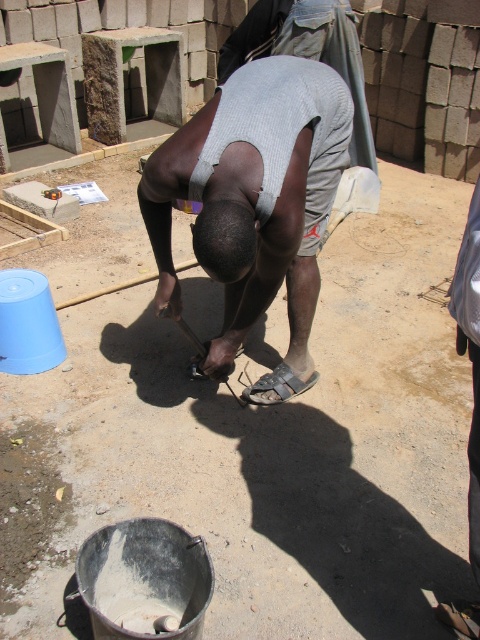
Question: Is the position of gray fabric shirt at center less distant than that of metallic silver shovel at lower center?

Choices:
 (A) yes
 (B) no

Answer: (A)

Question: Which of the following is the closest to the observer?

Choices:
 (A) metallic silver shovel at lower center
 (B) gray fabric shirt at center

Answer: (B)

Question: Can you confirm if gray fabric shirt at center is positioned to the left of metallic silver shovel at lower center?

Choices:
 (A) no
 (B) yes

Answer: (A)

Question: Does gray fabric shirt at center have a lesser width compared to metallic silver shovel at lower center?

Choices:
 (A) no
 (B) yes

Answer: (A)